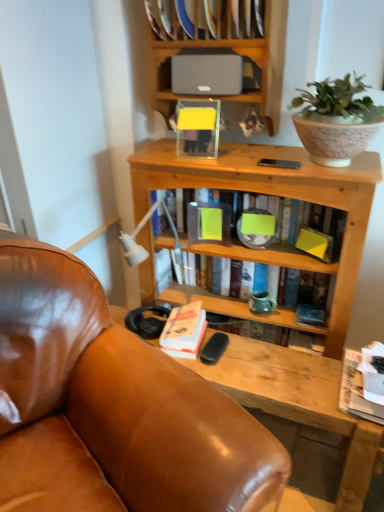
Locate an element on the screen. This screenshot has height=512, width=384. free point above white matte book at center, the third book when ordered from top to bottom (from a real-world perspective) is located at coordinates (184, 330).